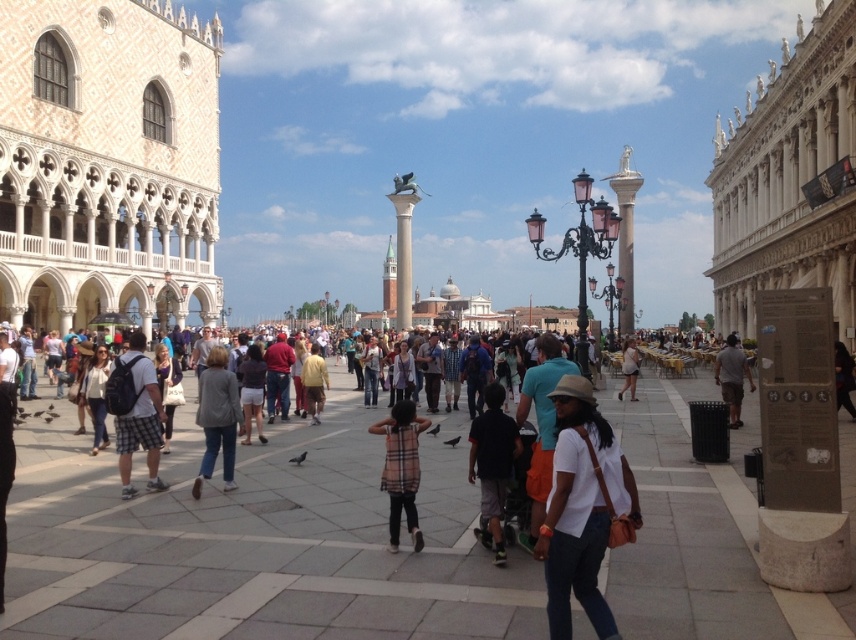
Is matte gray pavement at center shorter than white marble palace at right?

Yes.

You are a GUI agent. You are given a task and a screenshot of the screen. Output one action in this format:
    pyautogui.click(x=<x>, y=<y>)
    Task: Click on the matte gray pavement at center
    The width and height of the screenshot is (856, 640).
    Given the screenshot: What is the action you would take?
    pyautogui.click(x=256, y=540)

Which of these two, denim jacket at center or matte black backpack at center, stands shorter?

With less height is matte black backpack at center.

Find the location of a particular element. denim jacket at center is located at coordinates (217, 417).

The width and height of the screenshot is (856, 640). Identify the location of denim jacket at center. (217, 417).

Can you confirm if white marble palace at right is positioned to the left of matte black backpack at center?

In fact, white marble palace at right is to the right of matte black backpack at center.

Does white marble palace at right have a lesser height compared to matte black backpack at center?

Incorrect, white marble palace at right's height does not fall short of matte black backpack at center's.

Does point (746, 204) come closer to viewer compared to point (92, 387)?

No, (746, 204) is further to viewer.

I want to click on white marble palace at right, so click(789, 179).